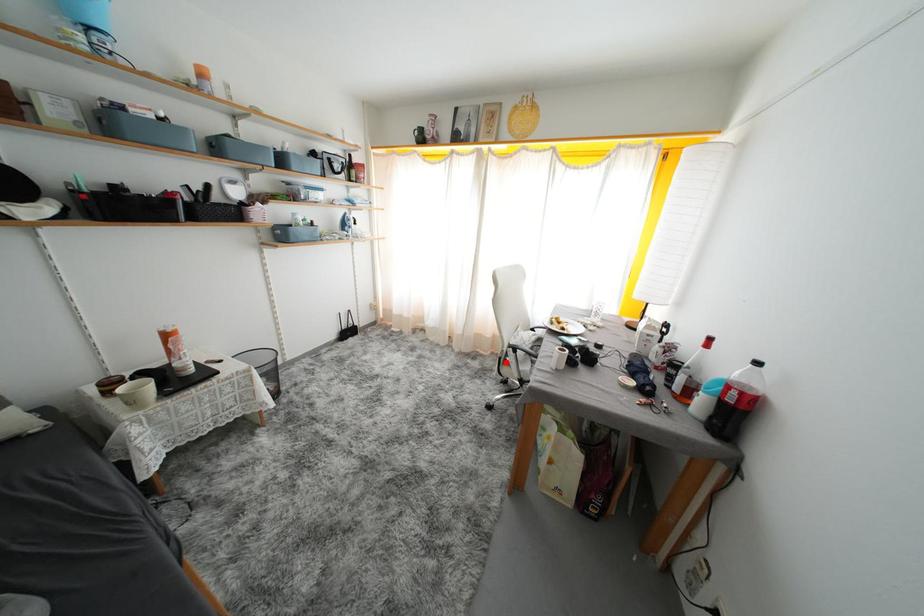
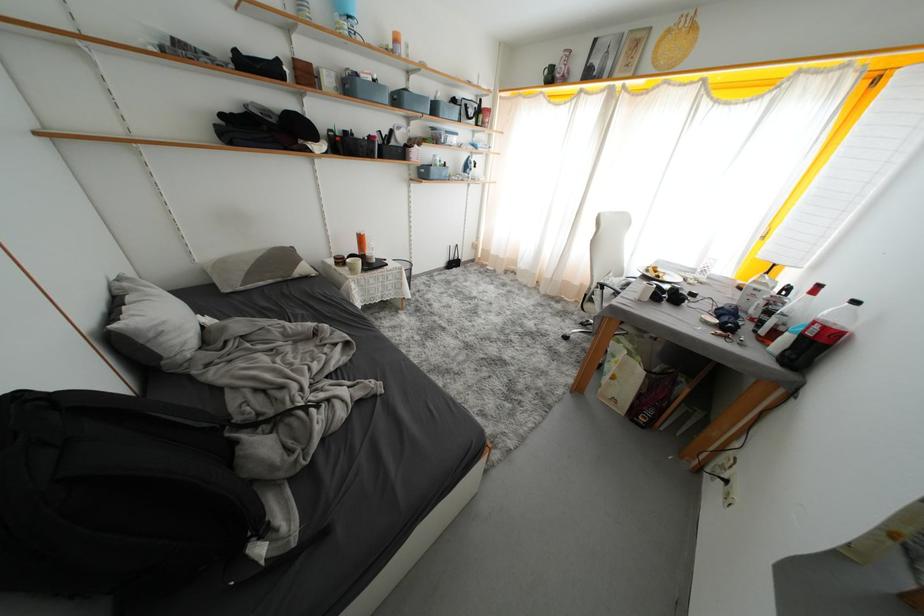
The point at the highlighted location is marked in the first image. Where is the corresponding point in the second image?

(591, 299)